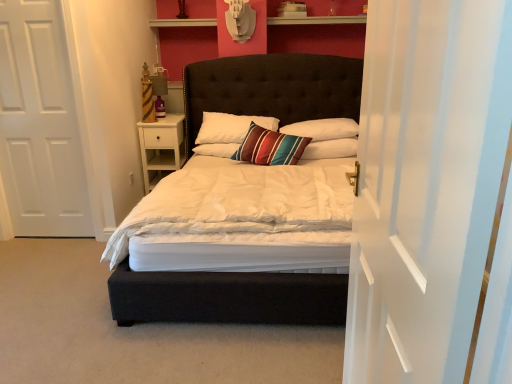
Question: From a real-world perspective, relative to striped fabric pillow at center, the 1th pillow when ordered from left to right, is white soft pillow at center, which is counted as the third pillow, starting from the left, vertically above or below?

Choices:
 (A) below
 (B) above

Answer: (A)

Question: Is white soft pillow at center, acting as the 1th pillow starting from the right, inside or outside of striped fabric pillow at center, which is the 3th pillow in right-to-left order?

Choices:
 (A) inside
 (B) outside

Answer: (B)

Question: Based on their relative distances, which object is farther from the white sheer curtain at right?

Choices:
 (A) white matte door at left
 (B) velvet dark brown bed at center
 (C) white soft pillow at center, acting as the 1th pillow starting from the right
 (D) white wood nightstand at left
 (E) striped fabric pillow at center, which is the 2th pillow in right-to-left order

Answer: (B)

Question: Which object is the closest to the white matte door at left?

Choices:
 (A) white sheer curtain at right
 (B) white wood nightstand at left
 (C) white soft pillow at center, acting as the 1th pillow starting from the right
 (D) striped fabric pillow at center, the 1th pillow when ordered from left to right
 (E) striped fabric pillow at center, the 2th pillow from the left

Answer: (B)